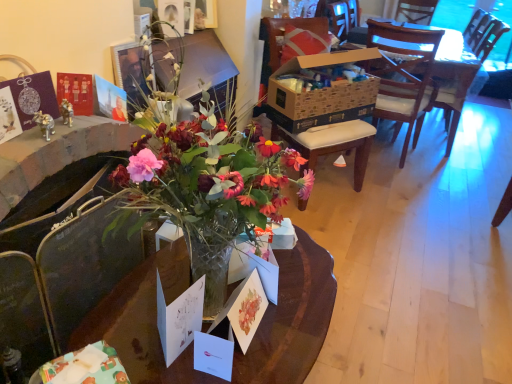
Find the location of a particular element. The height and width of the screenshot is (384, 512). free space in front of white paper postcard at center, marked as the 3th postcard in a right-to-left arrangement is located at coordinates (160, 369).